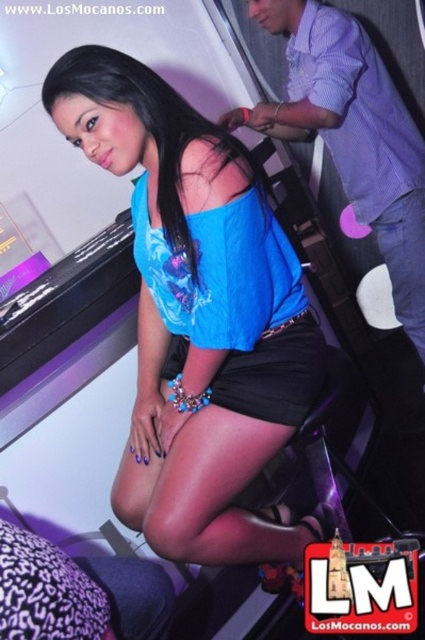
Question: Which point is farther from the camera taking this photo?

Choices:
 (A) click(346, 81)
 (B) click(265, 269)
 (C) click(240, 275)
 (D) click(286, 349)

Answer: (A)

Question: Does blue satin dress at center appear on the left side of black leather shorts at center?

Choices:
 (A) no
 (B) yes

Answer: (B)

Question: Does purple checkered shirt at upper right appear under black leather shorts at center?

Choices:
 (A) no
 (B) yes

Answer: (A)

Question: Is blue satin dress at center smaller than purple checkered shirt at upper right?

Choices:
 (A) no
 (B) yes

Answer: (B)

Question: Which of the following is the farthest from the observer?

Choices:
 (A) (380, 92)
 (B) (187, 390)
 (C) (265, 339)

Answer: (A)

Question: Which of the following is the closest to the observer?

Choices:
 (A) (312, 67)
 (B) (243, 412)
 (C) (331, 54)
 (D) (252, 264)

Answer: (D)